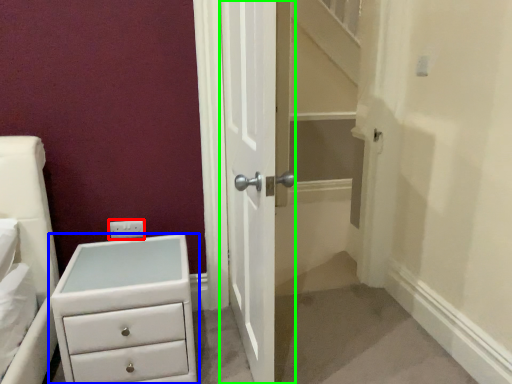
Question: Considering the real-world distances, which object is farthest from electric outlet (highlighted by a red box)? chest of drawers (highlighted by a blue box) or door (highlighted by a green box)?

Choices:
 (A) chest of drawers
 (B) door

Answer: (B)